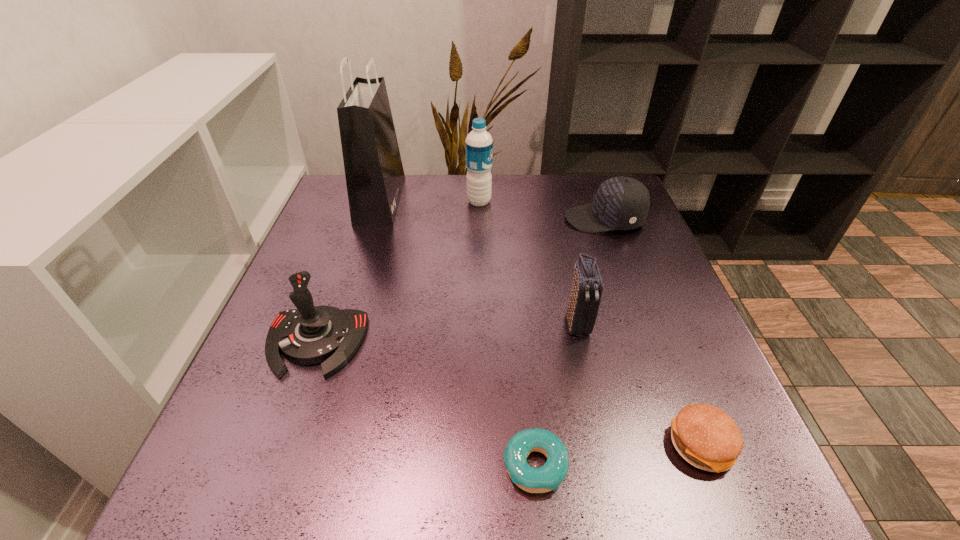
Where is `the tallest object`? the tallest object is located at coordinates (374, 173).

At what (x,y) coordinates should I click in order to perform the action: click on the fifth object from right to left. Please return your answer as a coordinate pair (x, y). This screenshot has height=540, width=960. Looking at the image, I should click on (479, 145).

At what (x,y) coordinates should I click in order to perform the action: click on the second tallest object. Please return your answer as a coordinate pair (x, y). Image resolution: width=960 pixels, height=540 pixels. Looking at the image, I should click on [x=479, y=145].

Locate an element on the screen. This screenshot has height=540, width=960. the fifth object from left to right is located at coordinates (583, 305).

Where is `joystick`? joystick is located at coordinates pos(308,335).

Where is `baseball cap`? baseball cap is located at coordinates (621, 203).

This screenshot has width=960, height=540. I want to click on hamburger, so click(x=705, y=436).

Find the location of `doughnut`. doughnut is located at coordinates (548, 477).

Locate an element on the screen. Image resolution: width=960 pixels, height=540 pixels. the shortest object is located at coordinates coord(548,477).

At what (x,y) coordinates should I click in order to perform the action: click on free space located 0.050m on the front with handles of the shopping bag. Please return your answer as a coordinate pair (x, y). Looking at the image, I should click on (418, 200).